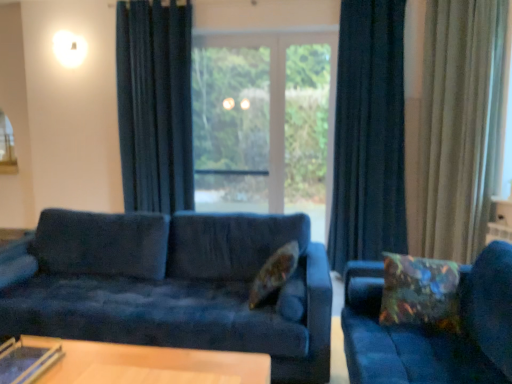
The image size is (512, 384). Describe the element at coordinates (435, 331) in the screenshot. I see `velvet blue couch at right, arranged as the first studio couch when viewed from the right` at that location.

Find the location of `multicolored fabric pillow at right, which appears as the 1th pillow when viewed from the right`. multicolored fabric pillow at right, which appears as the 1th pillow when viewed from the right is located at coordinates (420, 292).

In order to face multicolored fabric pillow at right, which appears as the 1th pillow when viewed from the right, should I rotate leftwards or rightwards?

To face it directly, rotate right by 21.447 degrees.

What do you see at coordinates (461, 123) in the screenshot?
I see `beige velvet curtain at right, the 3th curtain positioned from the left` at bounding box center [461, 123].

The width and height of the screenshot is (512, 384). Describe the element at coordinates (369, 134) in the screenshot. I see `dark blue velvet curtain at center, which is the 2th curtain from left to right` at that location.

Measure the distance between transparent glass table at lower left and camera.

They are 5.60 feet apart.

Where is `transparent glass screen door at center`? transparent glass screen door at center is located at coordinates (309, 130).

Locate an element on the screen. This screenshot has height=384, width=512. velvet blue couch at right, arranged as the first studio couch when viewed from the right is located at coordinates point(435,331).

You are a GUI agent. You are given a task and a screenshot of the screen. Output one action in this format:
    pyautogui.click(x=<x>, y=<y>)
    Task: Click on the window screen above the beige velvet curtain at right, the 3th curtain positioned from the left (from a real-world perspective)
    The height and width of the screenshot is (384, 512).
    Given the screenshot: What is the action you would take?
    pyautogui.click(x=230, y=110)

In terms of height, does transparent glass window at center look taller or shorter compared to beige velvet curtain at right, which is the first curtain in right-to-left order?

Clearly, transparent glass window at center is shorter compared to beige velvet curtain at right, which is the first curtain in right-to-left order.

Which is nearer, [255,137] or [425,159]?

Point [255,137] is positioned farther from the camera compared to point [425,159].

How many degrees apart are the facing directions of transparent glass window at center and beige velvet curtain at right, the 3th curtain positioned from the left?

The angular difference between transparent glass window at center and beige velvet curtain at right, the 3th curtain positioned from the left, is 58.4 degrees.

From the picture: From the image's perspective, who appears lower, transparent glass screen door at center or velvet blue couch at center, the 2th studio couch positioned from the right?

From the image's view, velvet blue couch at center, the 2th studio couch positioned from the right, is below.

Does transparent glass screen door at center have a greater height compared to velvet blue couch at center, the 2th studio couch positioned from the right?

Yes.

Does point (325, 108) come behind point (305, 232)?

Yes, it is.

Is point (357, 380) positioned behind point (319, 121)?

That is False.

I want to click on screen door behind the velvet blue couch at right, arranged as the 2th studio couch when viewed from the left, so click(x=309, y=130).

Considering the sizes of objects velvet blue couch at right, arranged as the 2th studio couch when viewed from the left, and transparent glass screen door at center in the image provided, who is smaller, velvet blue couch at right, arranged as the 2th studio couch when viewed from the left, or transparent glass screen door at center?

transparent glass screen door at center.

From the image's perspective, is velvet blue couch at right, arranged as the first studio couch when viewed from the right, on top of transparent glass screen door at center?

No, from the image's perspective, velvet blue couch at right, arranged as the first studio couch when viewed from the right, is not over transparent glass screen door at center.

Is transparent glass table at lower left facing away from floral fabric pillow at center, which is counted as the 1th pillow, starting from the left?

That's not correct — transparent glass table at lower left is not looking away from floral fabric pillow at center, which is counted as the 1th pillow, starting from the left.

From a real-world perspective, is transparent glass table at lower left positioned over floral fabric pillow at center, marked as the 2th pillow in a right-to-left arrangement, based on gravity?

No, from a real-world perspective, transparent glass table at lower left is not above floral fabric pillow at center, marked as the 2th pillow in a right-to-left arrangement.

Considering the relative sizes of transparent glass table at lower left and floral fabric pillow at center, marked as the 2th pillow in a right-to-left arrangement, in the image provided, is transparent glass table at lower left thinner than floral fabric pillow at center, marked as the 2th pillow in a right-to-left arrangement,?

No, transparent glass table at lower left is not thinner than floral fabric pillow at center, marked as the 2th pillow in a right-to-left arrangement.

Is transparent glass table at lower left taller or shorter than floral fabric pillow at center, which is counted as the 1th pillow, starting from the left?

In the image, transparent glass table at lower left appears to be shorter than floral fabric pillow at center, which is counted as the 1th pillow, starting from the left.

Is multicolored fabric pillow at right, which appears as the 1th pillow when viewed from the right, aimed at dark blue velvet curtain at center, which is counted as the second curtain, starting from the right?

No, multicolored fabric pillow at right, which appears as the 1th pillow when viewed from the right, is not facing towards dark blue velvet curtain at center, which is counted as the second curtain, starting from the right.

Based on the photo, considering their positions, is multicolored fabric pillow at right, placed as the 2th pillow when sorted from left to right, located in front of or behind dark blue velvet curtain at center, which is counted as the second curtain, starting from the right?

Clearly, multicolored fabric pillow at right, placed as the 2th pillow when sorted from left to right, is in front of dark blue velvet curtain at center, which is counted as the second curtain, starting from the right.

Can you confirm if multicolored fabric pillow at right, which appears as the 1th pillow when viewed from the right, is bigger than dark blue velvet curtain at center, which is counted as the second curtain, starting from the right?

No.

From a real-world perspective, which is physically below, multicolored fabric pillow at right, placed as the 2th pillow when sorted from left to right, or dark blue velvet curtain at center, which is the 2th curtain from left to right?

multicolored fabric pillow at right, placed as the 2th pillow when sorted from left to right, from a real-world perspective.

From the picture: From the image's perspective, is beige velvet curtain at right, which is the first curtain in right-to-left order, on transparent glass table at lower left?

Indeed, from the image's perspective, beige velvet curtain at right, which is the first curtain in right-to-left order, is shown above transparent glass table at lower left.

From a real-world perspective, does beige velvet curtain at right, the 3th curtain positioned from the left, stand above transparent glass table at lower left?

Yes, from a real-world perspective, beige velvet curtain at right, the 3th curtain positioned from the left, is above transparent glass table at lower left.

Is transparent glass table at lower left inside beige velvet curtain at right, the 3th curtain positioned from the left?

No, transparent glass table at lower left is not a part of beige velvet curtain at right, the 3th curtain positioned from the left.

Considering the positions of objects beige velvet curtain at right, the 3th curtain positioned from the left, and transparent glass table at lower left in the image provided, who is more to the left, beige velvet curtain at right, the 3th curtain positioned from the left, or transparent glass table at lower left?

Positioned to the left is transparent glass table at lower left.

Based on the photo, from a real-world perspective, is transparent glass window at center physically located above or below floral fabric pillow at center, marked as the 2th pillow in a right-to-left arrangement?

transparent glass window at center is above floral fabric pillow at center, marked as the 2th pillow in a right-to-left arrangement.

In terms of size, does transparent glass window at center appear bigger or smaller than floral fabric pillow at center, marked as the 2th pillow in a right-to-left arrangement?

Considering their sizes, transparent glass window at center takes up more space than floral fabric pillow at center, marked as the 2th pillow in a right-to-left arrangement.

Is transparent glass window at center looking in the opposite direction of floral fabric pillow at center, marked as the 2th pillow in a right-to-left arrangement?

That's not correct — transparent glass window at center is not looking away from floral fabric pillow at center, marked as the 2th pillow in a right-to-left arrangement.

Image resolution: width=512 pixels, height=384 pixels. What are the coordinates of `curtain that is the 2nd one when counting rightward from the transparent glass window at center` in the screenshot? It's located at (461, 123).

This screenshot has width=512, height=384. In order to click on screen door behind the velvet blue couch at center, arranged as the 1th studio couch when viewed from the left in this screenshot , I will do `click(309, 130)`.

Estimate the real-world distances between objects in this image. Which object is further from dark blue velvet curtain at center, arranged as the first curtain when viewed from the left, transparent glass table at lower left or beige velvet curtain at right, which is the first curtain in right-to-left order?

transparent glass table at lower left lies further to dark blue velvet curtain at center, arranged as the first curtain when viewed from the left, than the other object.

Estimate the real-world distances between objects in this image. Which object is further from floral fabric pillow at center, marked as the 2th pillow in a right-to-left arrangement, velvet blue couch at right, arranged as the 2th studio couch when viewed from the left, or multicolored fabric pillow at right, placed as the 2th pillow when sorted from left to right?

velvet blue couch at right, arranged as the 2th studio couch when viewed from the left.

From the image, which object appears to be farther from transparent glass table at lower left, velvet blue couch at right, arranged as the 2th studio couch when viewed from the left, or transparent glass screen door at center?

Based on the image, transparent glass screen door at center appears to be further to transparent glass table at lower left.

When comparing their distances from transparent glass window at center, does velvet blue couch at center, arranged as the 1th studio couch when viewed from the left, or multicolored fabric pillow at right, placed as the 2th pillow when sorted from left to right, seem closer?

The object closer to transparent glass window at center is velvet blue couch at center, arranged as the 1th studio couch when viewed from the left.

Looking at the image, which one is located closer to velvet blue couch at center, arranged as the 1th studio couch when viewed from the left, transparent glass screen door at center or beige velvet curtain at right, which is the first curtain in right-to-left order?

transparent glass screen door at center lies closer to velvet blue couch at center, arranged as the 1th studio couch when viewed from the left, than the other object.

From the image, which object appears to be nearer to transparent glass screen door at center, dark blue velvet curtain at center, arranged as the first curtain when viewed from the left, or multicolored fabric pillow at right, placed as the 2th pillow when sorted from left to right?

dark blue velvet curtain at center, arranged as the first curtain when viewed from the left, is closer to transparent glass screen door at center.

From the image, which object appears to be farther from dark blue velvet curtain at center, which is the 2th curtain from left to right, transparent glass table at lower left or transparent glass window at center?

The object further to dark blue velvet curtain at center, which is the 2th curtain from left to right, is transparent glass table at lower left.

Considering their positions, is multicolored fabric pillow at right, placed as the 2th pillow when sorted from left to right, positioned closer to dark blue velvet curtain at center, the 3th curtain in the right-to-left sequence, than transparent glass window at center?

transparent glass window at center lies closer to dark blue velvet curtain at center, the 3th curtain in the right-to-left sequence, than the other object.

Locate an element on the screen. studio couch located between transparent glass table at lower left and velvet blue couch at right, arranged as the first studio couch when viewed from the right, in the left-right direction is located at coordinates (174, 285).

Locate an element on the screen. screen door between multicolored fabric pillow at right, which appears as the 1th pillow when viewed from the right, and transparent glass window at center from front to back is located at coordinates (309, 130).

This screenshot has width=512, height=384. In order to click on pillow between multicolored fabric pillow at right, which appears as the 1th pillow when viewed from the right, and transparent glass window at center from front to back in this screenshot , I will do `click(274, 273)`.

Find the location of `studio couch located between transparent glass table at lower left and floral fabric pillow at center, which is counted as the 1th pillow, starting from the left, in the left-right direction`. studio couch located between transparent glass table at lower left and floral fabric pillow at center, which is counted as the 1th pillow, starting from the left, in the left-right direction is located at coordinates (174, 285).